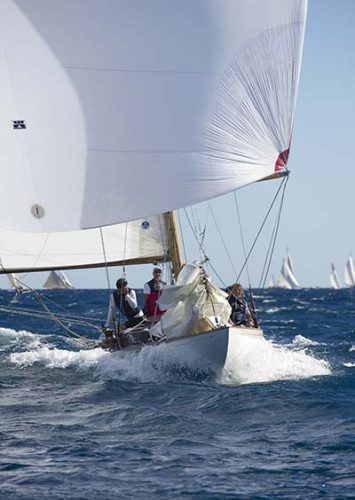
I want to click on wood post, so click(173, 237).